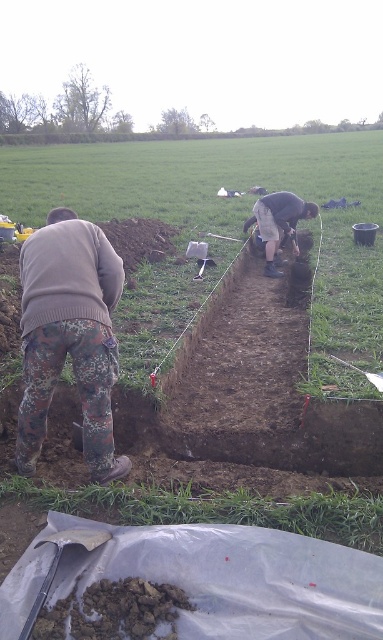
Which is behind, point (109, 362) or point (294, 232)?

Positioned behind is point (294, 232).

Does camouflage pants at left have a larger size compared to dark gray concrete squat at center?

Yes, camouflage pants at left is bigger than dark gray concrete squat at center.

The height and width of the screenshot is (640, 383). What do you see at coordinates (68, 336) in the screenshot? I see `camouflage pants at left` at bounding box center [68, 336].

Where is `camouflage pants at left`? This screenshot has height=640, width=383. camouflage pants at left is located at coordinates (68, 336).

Can you confirm if dark gray concrete squat at center is thinner than black plastic shovel at lower left?

Incorrect, dark gray concrete squat at center's width is not less than black plastic shovel at lower left's.

What do you see at coordinates (278, 224) in the screenshot? I see `dark gray concrete squat at center` at bounding box center [278, 224].

Is point (263, 221) positioned before point (54, 572)?

No, (263, 221) is behind (54, 572).

This screenshot has height=640, width=383. What are the coordinates of `dark gray concrete squat at center` in the screenshot? It's located at (278, 224).

Does camouflage pants at left lie behind black plastic shovel at lower left?

Yes.

Does camouflage pants at left have a greater height compared to black plastic shovel at lower left?

Indeed, camouflage pants at left has a greater height compared to black plastic shovel at lower left.

Where is `camouflage pants at left`? The height and width of the screenshot is (640, 383). camouflage pants at left is located at coordinates (68, 336).

The image size is (383, 640). What are the coordinates of `camouflage pants at left` in the screenshot? It's located at (68, 336).